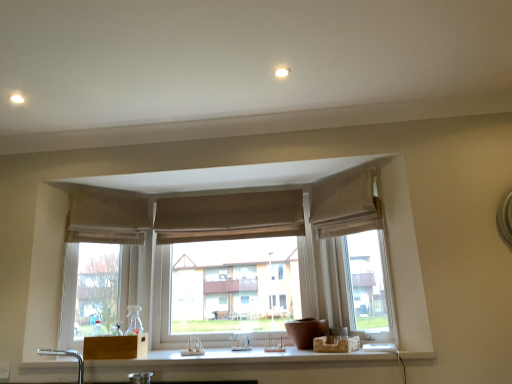
Question: Does beige fabric curtain at upper center, the 3th curtain in the right-to-left sequence, appear on the right side of brown fabric curtain at center, placed as the 2th curtain when sorted from left to right?

Choices:
 (A) no
 (B) yes

Answer: (A)

Question: Does beige fabric curtain at upper center, the 3th curtain in the right-to-left sequence, have a lesser width compared to brown fabric curtain at center, placed as the 2th curtain when sorted from left to right?

Choices:
 (A) no
 (B) yes

Answer: (A)

Question: Is beige fabric curtain at upper center, the 3th curtain in the right-to-left sequence, bigger than brown fabric curtain at center, placed as the 2th curtain when sorted from left to right?

Choices:
 (A) yes
 (B) no

Answer: (A)

Question: From a real-world perspective, is beige fabric curtain at upper center, the first curtain in the left-to-right sequence, located higher than brown fabric curtain at center, placed as the 2th curtain when sorted from left to right?

Choices:
 (A) yes
 (B) no

Answer: (B)

Question: From the image's perspective, does beige fabric curtain at upper center, the first curtain in the left-to-right sequence, appear higher than brown fabric curtain at center, placed as the 2th curtain when sorted from left to right?

Choices:
 (A) no
 (B) yes

Answer: (A)

Question: In terms of width, does brown fabric curtain at center, marked as the 2th curtain in a right-to-left arrangement, look wider or thinner when compared to beige fabric curtain at upper right, the 3th curtain when ordered from left to right?

Choices:
 (A) thin
 (B) wide

Answer: (A)

Question: From the image's perspective, is brown fabric curtain at center, marked as the 2th curtain in a right-to-left arrangement, positioned above or below beige fabric curtain at upper right, the 3th curtain when ordered from left to right?

Choices:
 (A) below
 (B) above

Answer: (A)

Question: Considering the relative positions of brown fabric curtain at center, placed as the 2th curtain when sorted from left to right, and beige fabric curtain at upper right, the 3th curtain when ordered from left to right, in the image provided, is brown fabric curtain at center, placed as the 2th curtain when sorted from left to right, to the left or to the right of beige fabric curtain at upper right, the 3th curtain when ordered from left to right,?

Choices:
 (A) right
 (B) left

Answer: (B)

Question: Which is correct: brown fabric curtain at center, placed as the 2th curtain when sorted from left to right, is inside beige fabric curtain at upper right, which ranks as the 1th curtain in right-to-left order, or outside of it?

Choices:
 (A) outside
 (B) inside

Answer: (A)

Question: Would you say beige fabric curtain at upper center, the first curtain in the left-to-right sequence, is inside or outside beige fabric curtain at upper right, which ranks as the 1th curtain in right-to-left order?

Choices:
 (A) inside
 (B) outside

Answer: (B)

Question: Is point (104, 218) positioned closer to the camera than point (355, 195)?

Choices:
 (A) farther
 (B) closer

Answer: (A)

Question: In terms of height, does beige fabric curtain at upper center, the 3th curtain in the right-to-left sequence, look taller or shorter compared to beige fabric curtain at upper right, which ranks as the 1th curtain in right-to-left order?

Choices:
 (A) short
 (B) tall

Answer: (A)

Question: In the image, is beige fabric curtain at upper center, the first curtain in the left-to-right sequence, on the left side or the right side of beige fabric curtain at upper right, which ranks as the 1th curtain in right-to-left order?

Choices:
 (A) left
 (B) right

Answer: (A)

Question: Is beige fabric curtain at upper center, the first curtain in the left-to-right sequence, bigger or smaller than brown fabric curtain at center, placed as the 2th curtain when sorted from left to right?

Choices:
 (A) small
 (B) big

Answer: (B)

Question: Relative to brown fabric curtain at center, marked as the 2th curtain in a right-to-left arrangement, is beige fabric curtain at upper center, the 3th curtain in the right-to-left sequence, in front or behind?

Choices:
 (A) front
 (B) behind

Answer: (A)